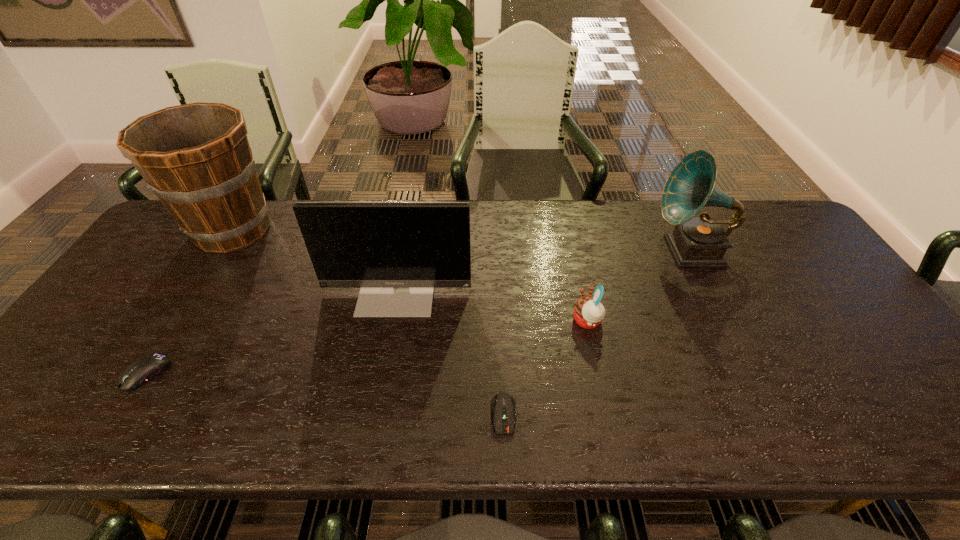
This screenshot has height=540, width=960. Find the location of `object that is at the near edge`. object that is at the near edge is located at coordinates (503, 404).

This screenshot has height=540, width=960. In order to click on object that is at the left edge in this screenshot , I will do `click(196, 158)`.

The height and width of the screenshot is (540, 960). What are the coordinates of `object at the far left corner` in the screenshot? It's located at (196, 158).

Identify the location of vacant point at the far edge. (254, 245).

Where is `free space at the near edge`? free space at the near edge is located at coordinates (156, 405).

The width and height of the screenshot is (960, 540). In the image, there is a desktop. Identify the location of vacant region at the left edge. (108, 377).

You are a GUI agent. You are given a task and a screenshot of the screen. Output one action in this format:
    pyautogui.click(x=<x>, y=<y>)
    Task: Click on the free spot at the right edge of the desktop
    
    Given the screenshot: What is the action you would take?
    pyautogui.click(x=835, y=358)

Find the location of a particular element. The height and width of the screenshot is (540, 960). vacant space at the near left corner of the desktop is located at coordinates (x=63, y=426).

This screenshot has height=540, width=960. Find the location of `empty space between the fifth farthest object and the third object from left to right`. empty space between the fifth farthest object and the third object from left to right is located at coordinates (272, 332).

Where is `free spot between the third object from left to right and the fifth farthest object`? Image resolution: width=960 pixels, height=540 pixels. free spot between the third object from left to right and the fifth farthest object is located at coordinates (272, 332).